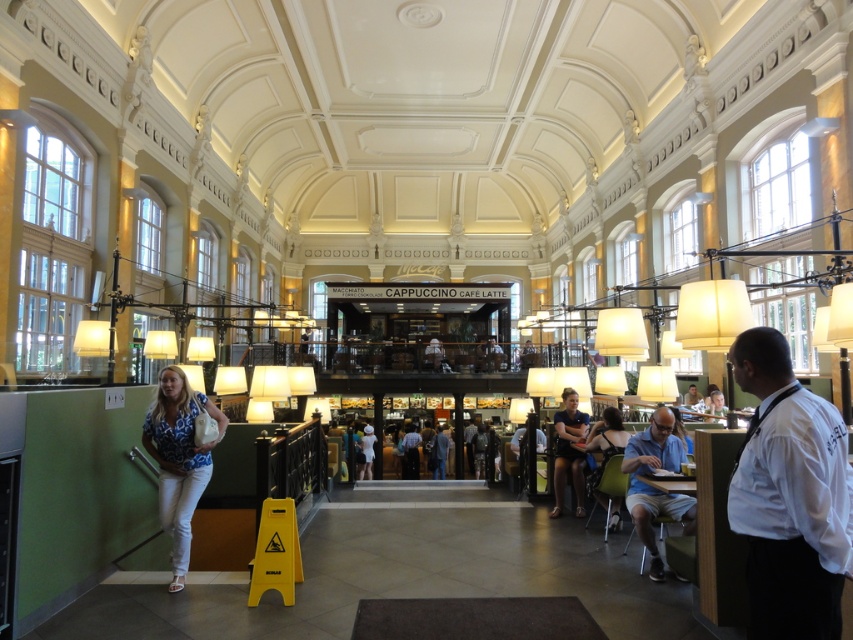
Question: Does light blue shirt at lower right appear on the left side of matte black dress at center?

Choices:
 (A) yes
 (B) no

Answer: (B)

Question: Which object appears farthest from the camera in this image?

Choices:
 (A) matte black dress at center
 (B) white shirt at right
 (C) dark blue shirt at center
 (D) light blue shirt at lower right

Answer: (C)

Question: Which object appears closest to the camera in this image?

Choices:
 (A) dark blue shirt at center
 (B) blue printed blouse at lower left

Answer: (B)

Question: Does blue printed blouse at lower left come behind light blue shirt at lower right?

Choices:
 (A) yes
 (B) no

Answer: (B)

Question: Is light blue shirt at lower right further to the viewer compared to dark blue shirt at center?

Choices:
 (A) yes
 (B) no

Answer: (B)

Question: Which point is farther from the camera taking this photo?

Choices:
 (A) (566, 445)
 (B) (590, 445)

Answer: (A)